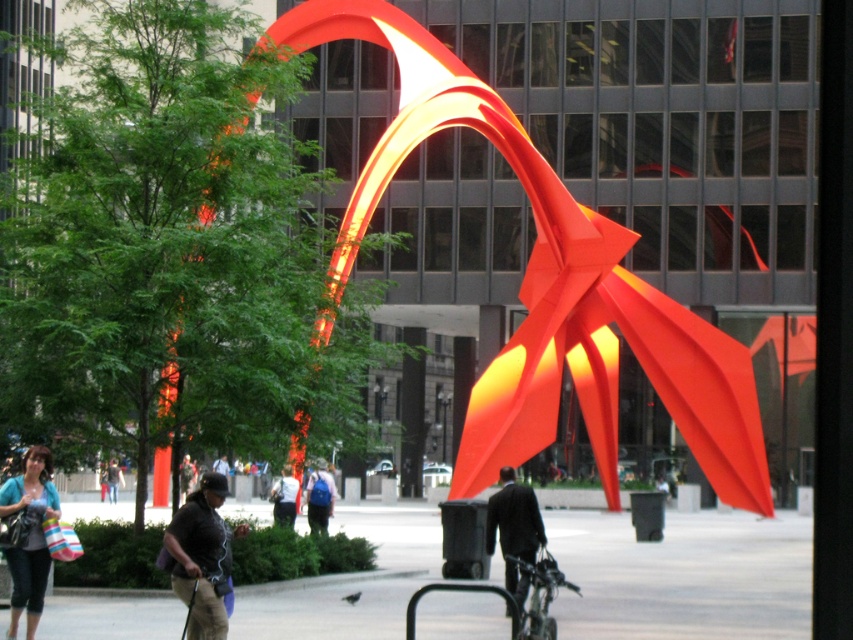
Question: Can you confirm if dark brown leather jacket at lower left is positioned to the left of blue fabric backpack at center?

Choices:
 (A) no
 (B) yes

Answer: (A)

Question: Does dark brown leather jacket at lower left have a greater width compared to dark blue shirt at center?

Choices:
 (A) no
 (B) yes

Answer: (A)

Question: Which object is positioned closest to the dark brown leather jacket at lower left?

Choices:
 (A) light blue denim jacket at center
 (B) matte blue shirt at lower left
 (C) dark suit at center

Answer: (B)

Question: Can you confirm if dark brown leather jacket at lower left is positioned to the right of dark suit at center?

Choices:
 (A) no
 (B) yes

Answer: (A)

Question: Among these points, which one is nearest to the camera?

Choices:
 (A) (498, 513)
 (B) (273, 512)
 (C) (45, 456)
 (D) (334, 492)

Answer: (C)

Question: Which object appears closest to the camera in this image?

Choices:
 (A) matte blue shirt at lower left
 (B) blue fabric backpack at center

Answer: (A)